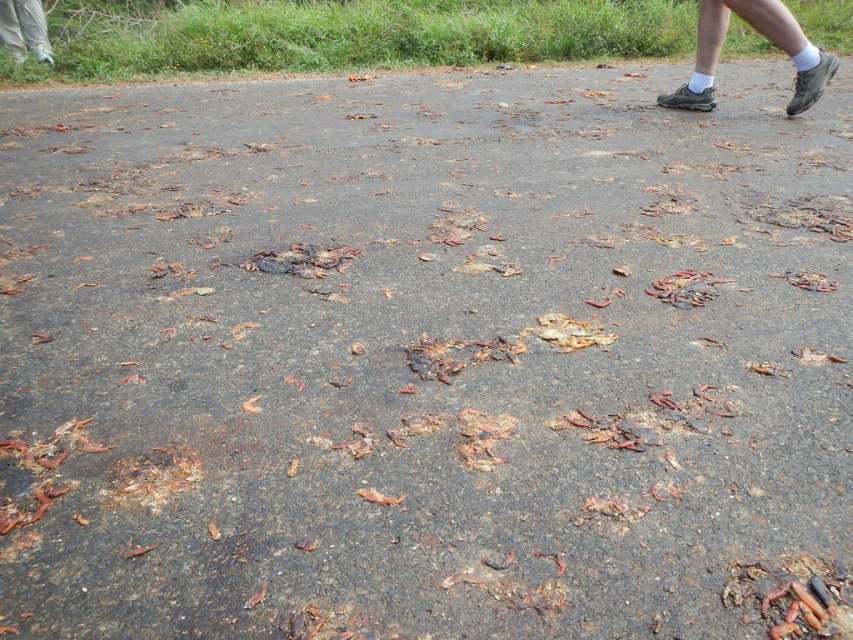
Question: Does brown asphalt road at upper center have a greater width compared to gray suede shoes at upper right?

Choices:
 (A) no
 (B) yes

Answer: (A)

Question: Which point is farther to the camera?

Choices:
 (A) [x=772, y=32]
 (B) [x=527, y=33]

Answer: (B)

Question: Is gray suede shoes at upper right to the right of white striped pants at upper left from the viewer's perspective?

Choices:
 (A) yes
 (B) no

Answer: (A)

Question: Does brown asphalt road at upper center have a greater width compared to white striped pants at upper left?

Choices:
 (A) yes
 (B) no

Answer: (B)

Question: Among these points, which one is nearest to the camera?

Choices:
 (A) (247, 52)
 (B) (775, 1)

Answer: (B)

Question: Which point appears farthest from the camera in this image?

Choices:
 (A) (18, 8)
 (B) (529, 28)

Answer: (B)